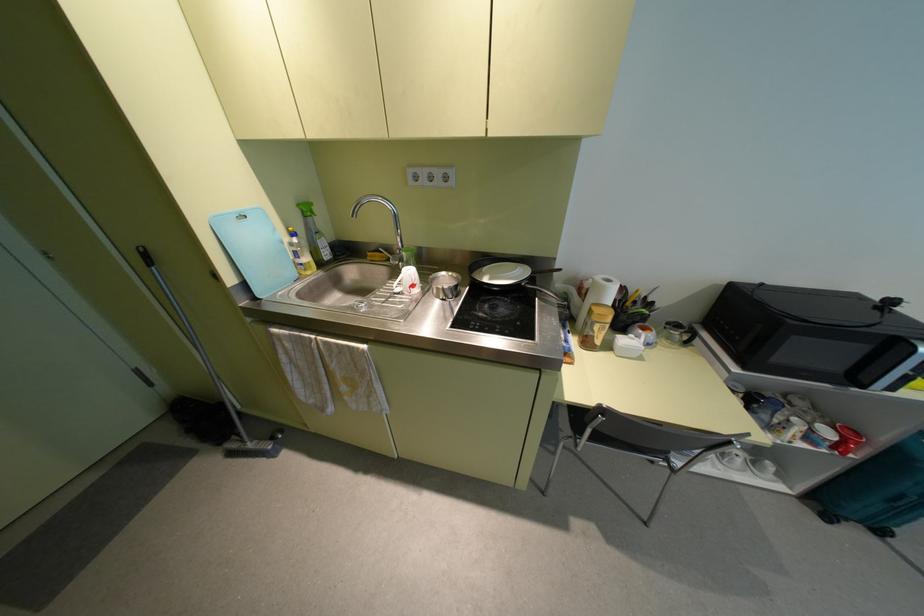
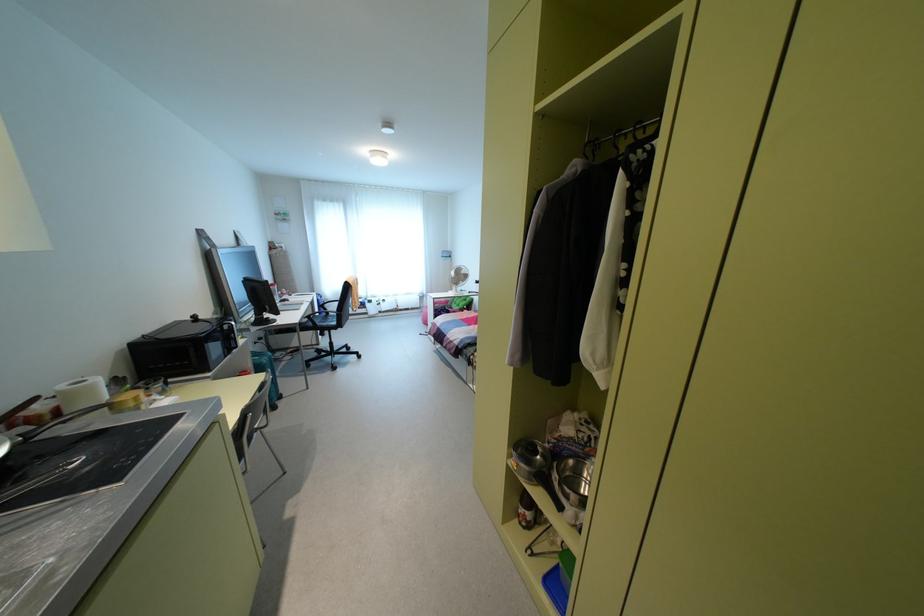
Where in the second image is the point corresponding to [855,378] from the first image?

(229, 346)